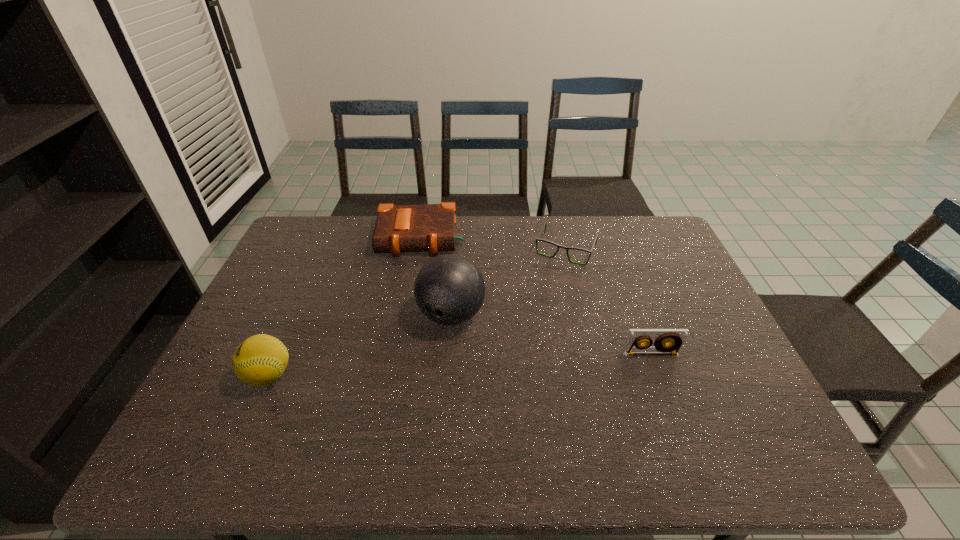
This screenshot has height=540, width=960. What are the coordinates of `the fourth shortest object` in the screenshot? It's located at (260, 360).

Identify the location of the leftmost object. The height and width of the screenshot is (540, 960). (260, 360).

The image size is (960, 540). I want to click on videotape, so click(676, 337).

This screenshot has height=540, width=960. In order to click on the second shortest object in this screenshot , I will do `click(430, 228)`.

Image resolution: width=960 pixels, height=540 pixels. Identify the location of spectacles. (545, 225).

The width and height of the screenshot is (960, 540). I want to click on the third farthest object, so click(449, 289).

At what (x,y) coordinates should I click in order to perform the action: click on bowling ball. Please return your answer as a coordinate pair (x, y). Looking at the image, I should click on (449, 289).

Locate an element on the screen. This screenshot has height=540, width=960. free point located on the logo side of the fourth shortest object is located at coordinates (212, 375).

Locate an element on the screen. vacant space located 0.080m at the front of the videotape with visible reels is located at coordinates (661, 383).

Where is `vacant area situated on the spine side of the Bible`? This screenshot has width=960, height=540. vacant area situated on the spine side of the Bible is located at coordinates (415, 306).